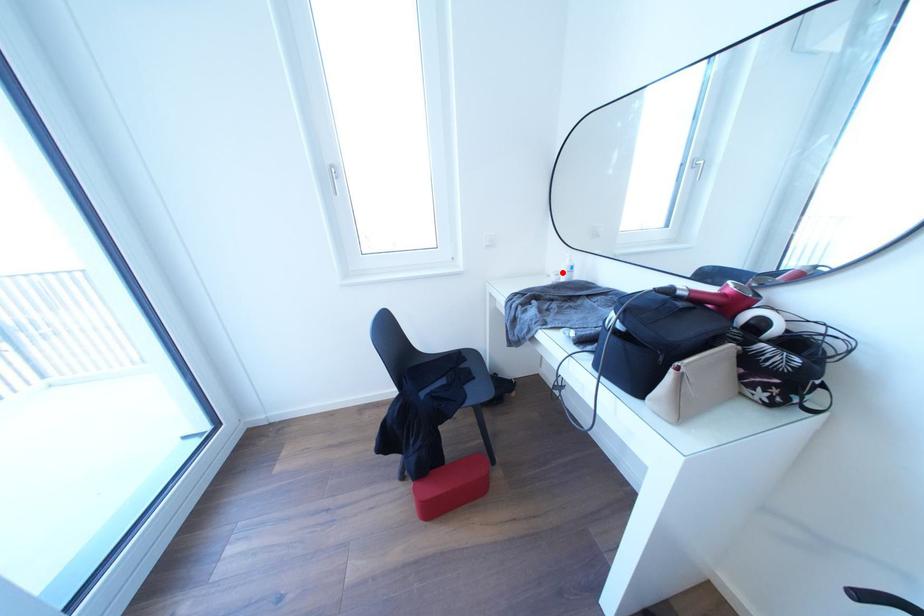
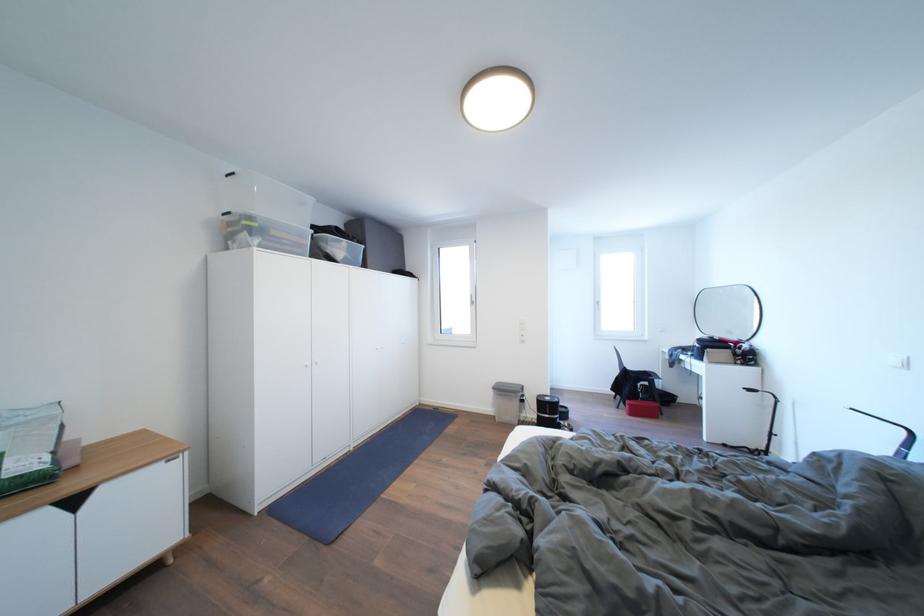
Question: I am providing you with two images of the same scene from different viewpoints. A red point is marked on the first image. Is the red point's position out of view in image 2?

Choices:
 (A) Yes
 (B) No

Answer: (A)